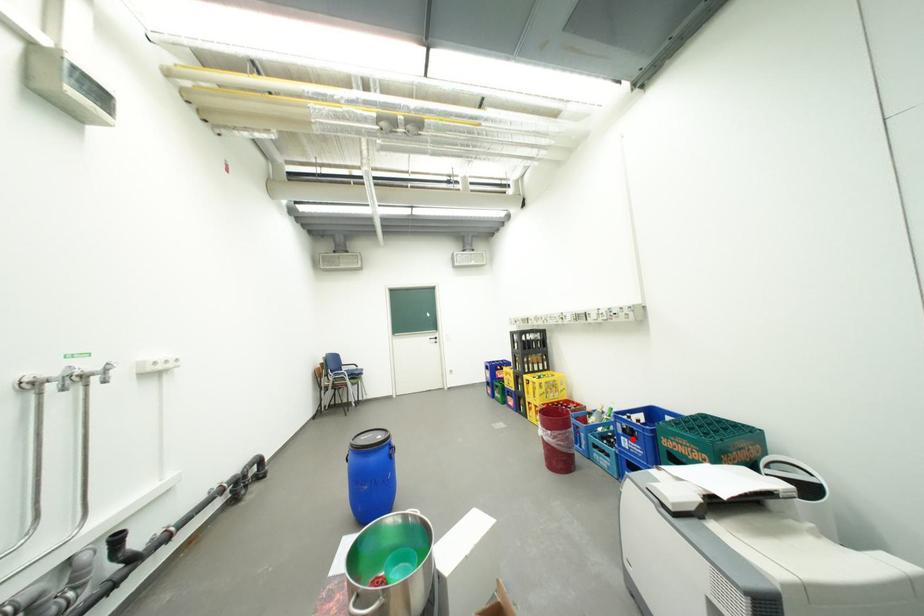
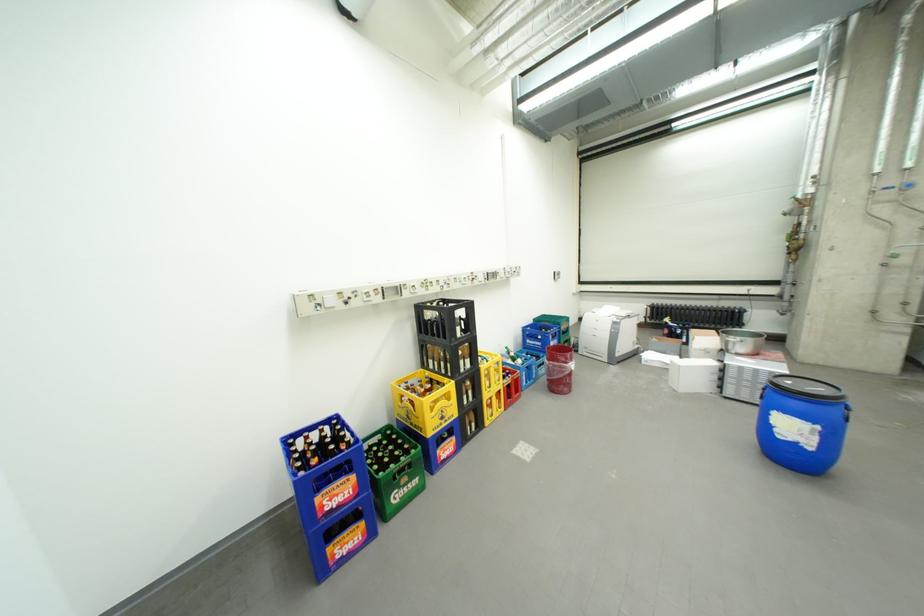
The point at the highlighted location is marked in the first image. Where is the corresponding point in the second image?

(562, 344)